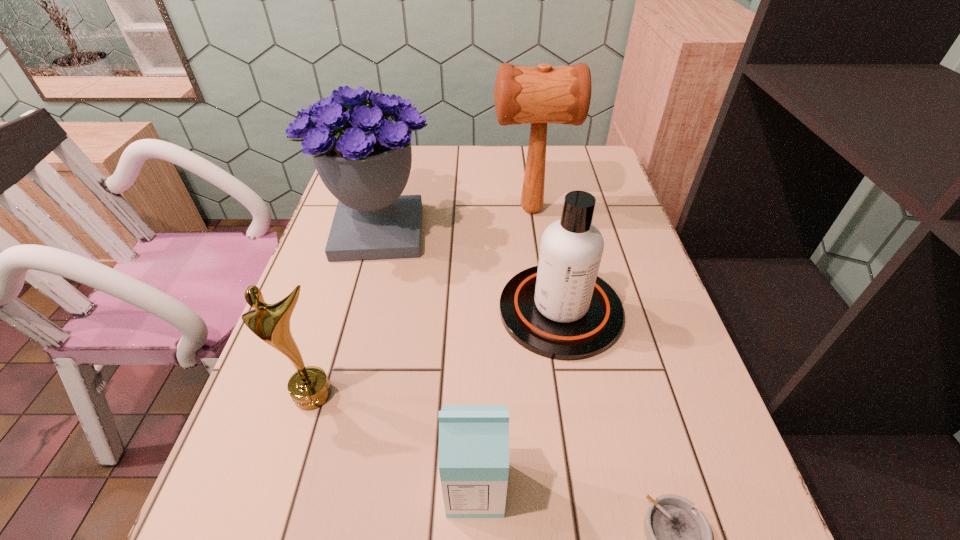
This screenshot has height=540, width=960. What are the coordinates of `free space that satisfies the following two spatial constraints: 1. on the strike surface of the cleansing agent; 2. on the right side of the mallet` in the screenshot? It's located at (545, 310).

In order to click on vacant space that satisfies the following two spatial constraints: 1. on the back side of the cleansing agent; 2. on the strike surface of the mallet in this screenshot , I will do `click(542, 210)`.

The image size is (960, 540). What are the coordinates of `vacant region that satisfies the following two spatial constraints: 1. on the strike surface of the mallet; 2. on the front-facing side of the fourth farthest object` in the screenshot? It's located at (557, 394).